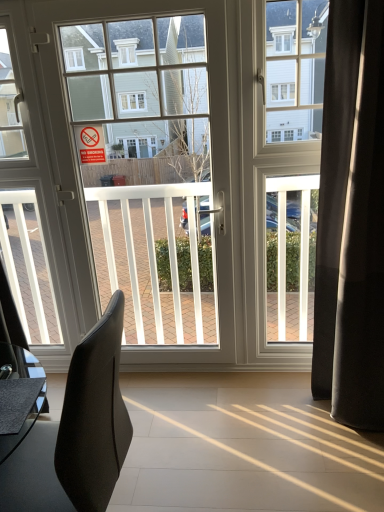
Question: Is black fabric curtain at right in front of white glossy door at center?

Choices:
 (A) no
 (B) yes

Answer: (B)

Question: Could white glossy door at center be considered to be inside black fabric curtain at right?

Choices:
 (A) no
 (B) yes

Answer: (A)

Question: Considering the relative sizes of black fabric curtain at right and white glossy door at center in the image provided, is black fabric curtain at right bigger than white glossy door at center?

Choices:
 (A) yes
 (B) no

Answer: (A)

Question: From the image's perspective, would you say black fabric curtain at right is positioned over white glossy door at center?

Choices:
 (A) no
 (B) yes

Answer: (A)

Question: Is black fabric curtain at right looking in the opposite direction of white glossy door at center?

Choices:
 (A) no
 (B) yes

Answer: (A)

Question: Does black fabric curtain at right have a greater height compared to white glossy door at center?

Choices:
 (A) no
 (B) yes

Answer: (A)

Question: From a real-world perspective, is black leather chair at left positioned over white glossy door at center based on gravity?

Choices:
 (A) no
 (B) yes

Answer: (A)

Question: From the image's perspective, is black leather chair at left on white glossy door at center?

Choices:
 (A) yes
 (B) no

Answer: (B)

Question: Is black leather chair at left taller than white glossy door at center?

Choices:
 (A) yes
 (B) no

Answer: (B)

Question: Is black leather chair at left to the left of white glossy door at center from the viewer's perspective?

Choices:
 (A) yes
 (B) no

Answer: (A)

Question: Is black leather chair at left turned away from white glossy door at center?

Choices:
 (A) no
 (B) yes

Answer: (A)

Question: Is black leather chair at left touching white glossy door at center?

Choices:
 (A) yes
 (B) no

Answer: (B)

Question: Does white glossy door at center have a lesser height compared to black leather chair at left?

Choices:
 (A) no
 (B) yes

Answer: (A)